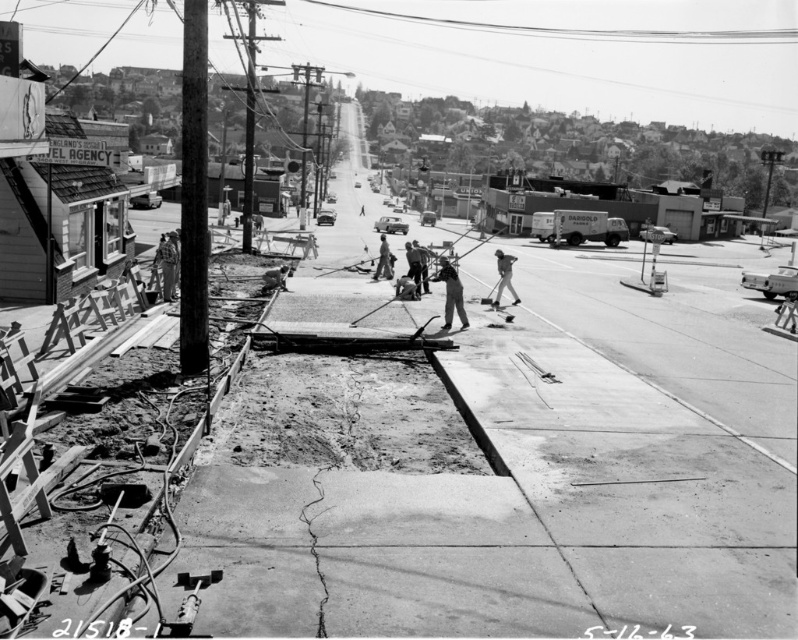
Is light brown leather jacket at left taller than dark gray concrete worker at center?

Incorrect, light brown leather jacket at left's height is not larger of dark gray concrete worker at center's.

Is light brown leather jacket at left smaller than dark gray concrete worker at center?

Actually, light brown leather jacket at left might be larger than dark gray concrete worker at center.

Where is `light brown leather jacket at left`? light brown leather jacket at left is located at coordinates (168, 262).

Is point (461, 285) positioned behind point (510, 273)?

No.

Can you confirm if dark gray fabric jacket at center is positioned below dark gray uniform at center?

No.

Find the location of `dark gray fabric jacket at center`. dark gray fabric jacket at center is located at coordinates [x=451, y=292].

Is dark gray fabric jacket at center behind dark gray concrete worker at center?

No.

Based on the photo, is dark gray fabric jacket at center taller than dark gray concrete worker at center?

No.

Is point (441, 275) positioned before point (378, 275)?

That is True.

This screenshot has height=640, width=798. I want to click on dark gray fabric jacket at center, so click(451, 292).